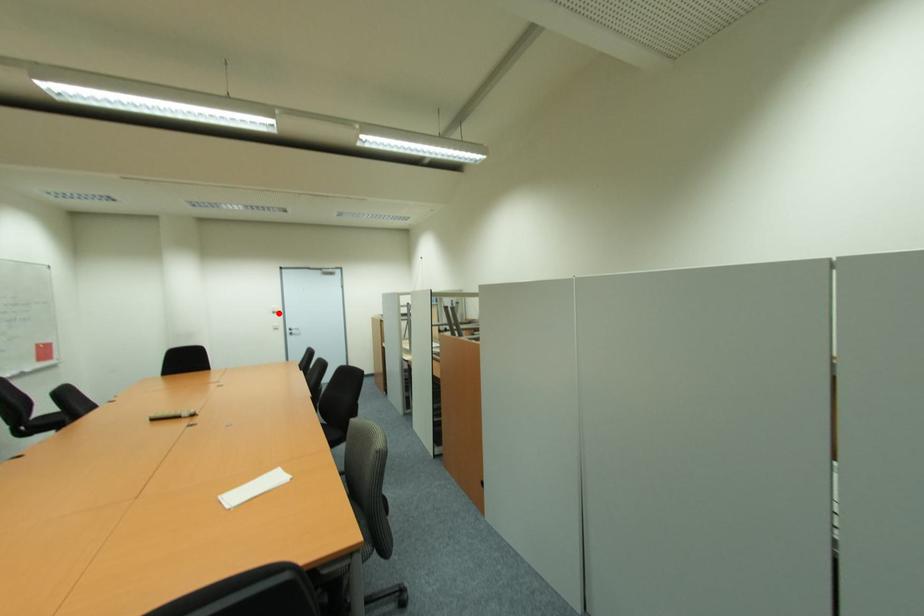
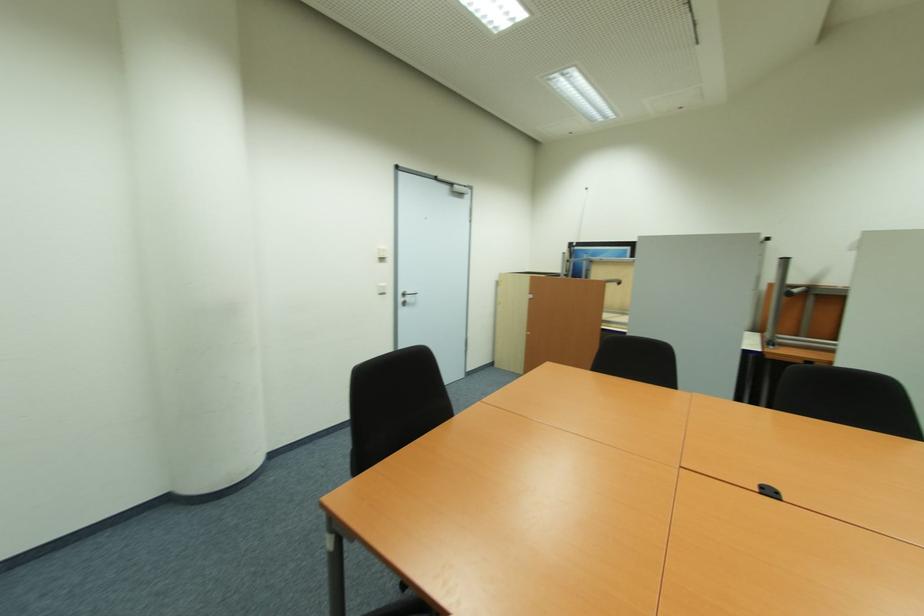
Question: I am providing you with two images of the same scene from different viewpoints. Image1 has a red point marked. In image2, the corresponding 3D location appears at what relative position? Reply with the corresponding letter.

Choices:
 (A) Closer
 (B) Farther

Answer: (B)